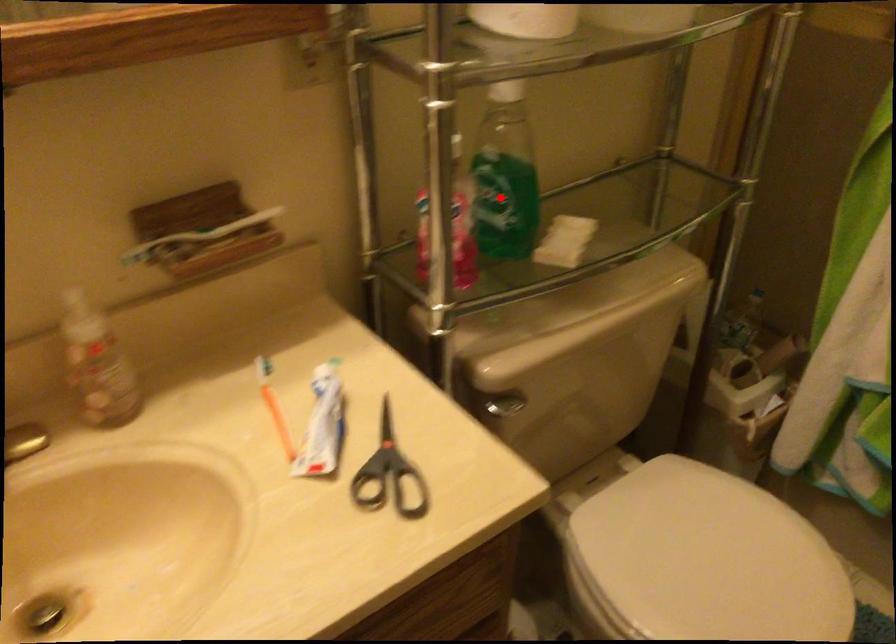
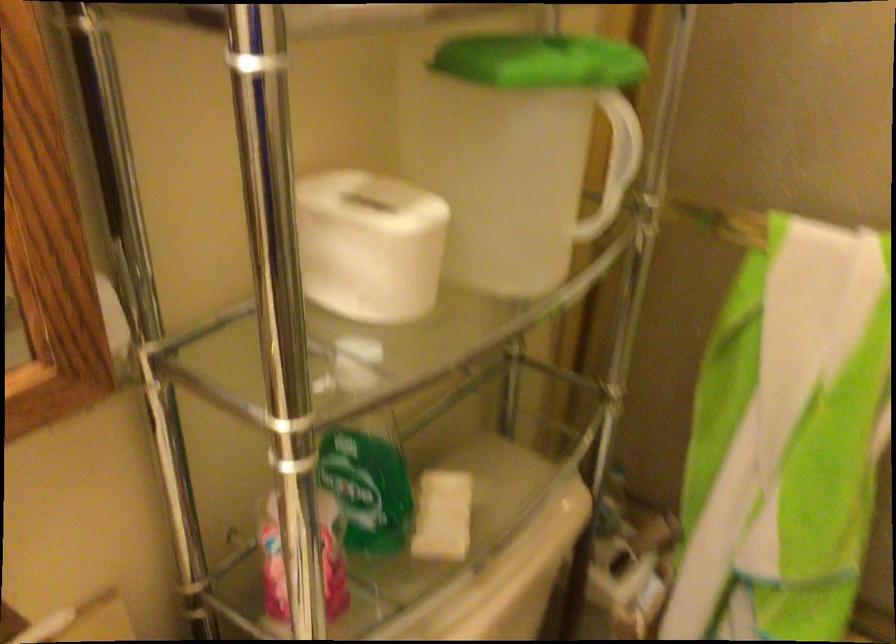
Find the pixel in the second image that matches the highlighted location in the first image.

(367, 489)